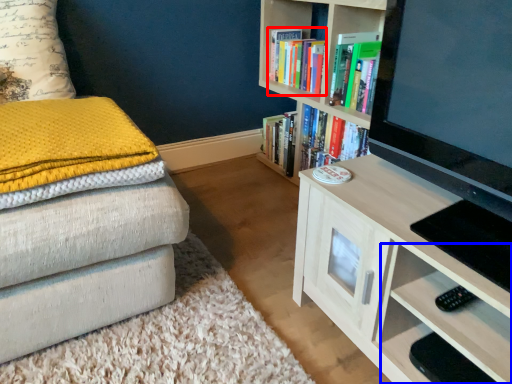
Question: Which point is further to the camera, book (highlighted by a red box) or drawer (highlighted by a blue box)?

Choices:
 (A) book
 (B) drawer

Answer: (A)